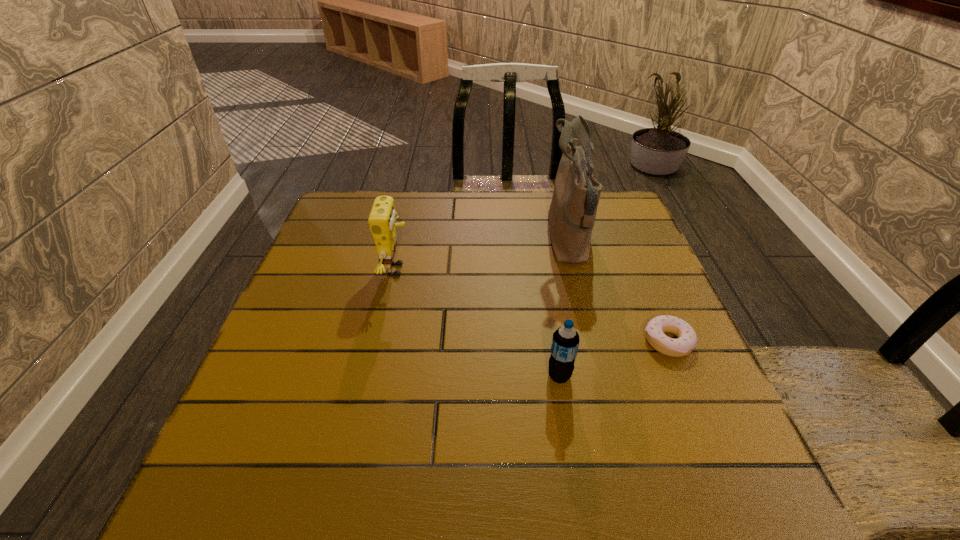
In the image, there is a desktop. Where is `vacant region at the near left corner`? The image size is (960, 540). vacant region at the near left corner is located at coordinates click(x=275, y=466).

In the image, there is a desktop. Where is `vacant space at the far right corner`? vacant space at the far right corner is located at coordinates (598, 237).

Where is `free space between the shoulder bag and the third shortest object`? The width and height of the screenshot is (960, 540). free space between the shoulder bag and the third shortest object is located at coordinates (483, 255).

Find the location of a particular element. This screenshot has width=960, height=540. unoccupied position between the second nearest object and the shoulder bag is located at coordinates pos(618,291).

This screenshot has width=960, height=540. I want to click on free space that is in between the tallest object and the third tallest object, so click(564, 308).

The width and height of the screenshot is (960, 540). I want to click on vacant area that lies between the leftmost object and the doughnut, so click(533, 306).

The height and width of the screenshot is (540, 960). I want to click on empty space that is in between the sponge and the tallest object, so click(483, 255).

Where is `free space between the tallest object and the second shortest object`? The height and width of the screenshot is (540, 960). free space between the tallest object and the second shortest object is located at coordinates (564, 308).

At what (x,y) coordinates should I click in order to perform the action: click on free point between the leftmost object and the second shortest object. Please return your answer as a coordinate pair (x, y). The height and width of the screenshot is (540, 960). Looking at the image, I should click on (478, 323).

You are a GUI agent. You are given a task and a screenshot of the screen. Output one action in this format:
    pyautogui.click(x=<x>, y=<y>)
    Task: Click on the vacant space that's between the doughnut and the shoulder bag
    The image size is (960, 540).
    Given the screenshot: What is the action you would take?
    [618, 291]